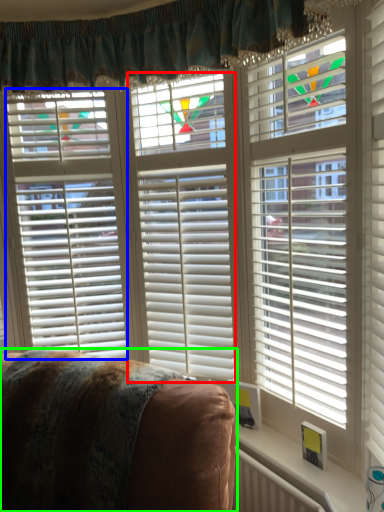
Question: Which is farther away from blind (highlighted by a red box)? blind (highlighted by a blue box) or furniture (highlighted by a green box)?

Choices:
 (A) blind
 (B) furniture

Answer: (B)